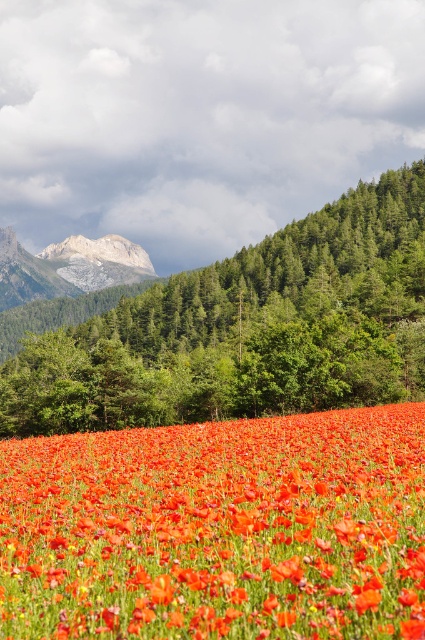
You are an artist planning to paint this landscape. You want to ensure that the bright red petals at center and the gray rocky mountain at upper left are proportionate. Which object should you make thinner in your painting to maintain the correct proportions?

The bright red petals at center is thinner than the gray rocky mountain at upper left, so to maintain correct proportions, you should make the bright red petals at center thinner in your painting.

You are standing in the field of bright red poppies and want to pick a flower at the exact location of point [218,529]. Based on the scene description, where should you look to find this flower?

The point [218,529] corresponds to bright red petals at center, so you should look at the center of the bright red poppies field to find the flower.

You are standing in the field of bright red poppies and want to walk towards the mountain range in the background. If you see two points marked as point [2,584] and point [350,273], which point should you head towards to reach the mountains more quickly?

Point [350,273] is further back than point [2,584], so heading towards point [350,273] would lead you closer to the mountains more quickly.